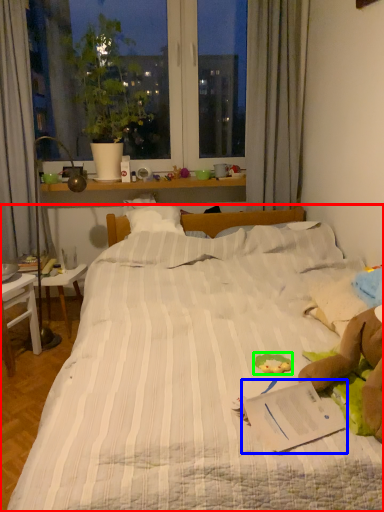
Question: Considering the real-world distances, which object is closest to bed (highlighted by a red box)? paperback book (highlighted by a blue box) or stuff (highlighted by a green box).

Choices:
 (A) paperback book
 (B) stuff

Answer: (A)